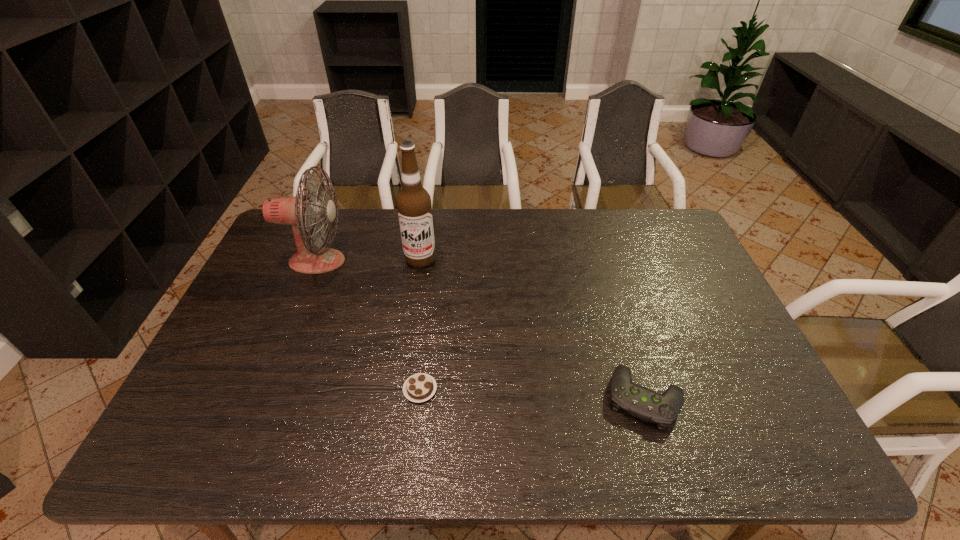
What are the coordinates of `alcohol that is positioned at the far edge` in the screenshot? It's located at (413, 202).

Identify the location of fan that is at the far edge. The image size is (960, 540). (299, 211).

Where is `object that is at the near edge`? This screenshot has width=960, height=540. object that is at the near edge is located at coordinates (662, 409).

The image size is (960, 540). I want to click on object that is at the left edge, so click(x=299, y=211).

You are a GUI agent. You are given a task and a screenshot of the screen. Output one action in this format:
    pyautogui.click(x=<x>, y=<y>)
    Task: Click on the object situated at the far left corner
    
    Given the screenshot: What is the action you would take?
    299,211

This screenshot has width=960, height=540. Find the location of `free space at the far edge`. free space at the far edge is located at coordinates (464, 231).

Locate an element on the screen. Image resolution: width=960 pixels, height=540 pixels. vacant space at the near edge is located at coordinates (287, 440).

Where is `free space at the left edge`? This screenshot has height=540, width=960. free space at the left edge is located at coordinates (291, 298).

You are a GUI agent. You are given a task and a screenshot of the screen. Output one action in this format:
    pyautogui.click(x=<x>, y=<y>)
    Task: Click on the vacant space at the right edge
    
    Given the screenshot: What is the action you would take?
    pyautogui.click(x=651, y=255)

Find the location of `vacant space at the far left corner of the desktop`. vacant space at the far left corner of the desktop is located at coordinates (326, 222).